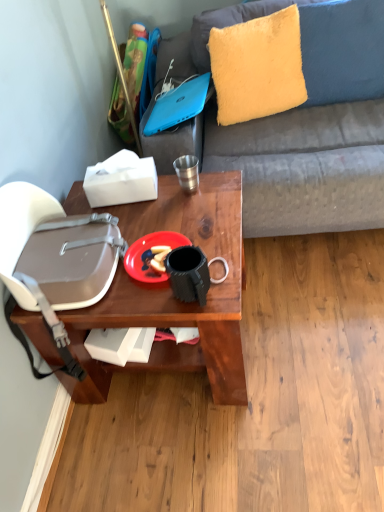
This screenshot has width=384, height=512. I want to click on free space in front of wooden table at center, so click(200, 452).